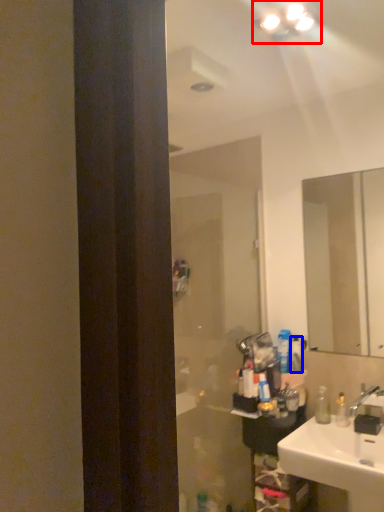
Question: Which point is further to the camera, light fixture (highlighted by a red box) or toiletry (highlighted by a blue box)?

Choices:
 (A) light fixture
 (B) toiletry

Answer: (B)